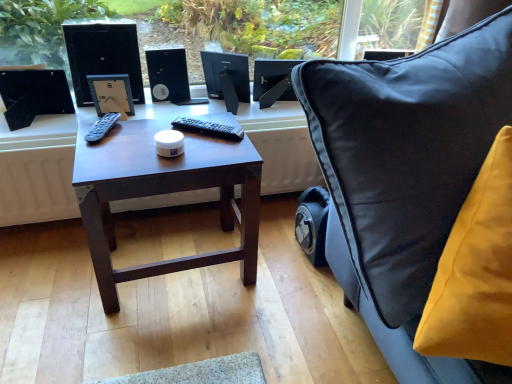
Question: Is black glossy desktop computer at upper left surrounding dark wood table at center?

Choices:
 (A) yes
 (B) no

Answer: (B)

Question: Is the position of black glossy desktop computer at upper left less distant than that of dark wood table at center?

Choices:
 (A) yes
 (B) no

Answer: (B)

Question: Can you confirm if black glossy desktop computer at upper left is taller than dark wood table at center?

Choices:
 (A) no
 (B) yes

Answer: (A)

Question: From a real-world perspective, is black glossy desktop computer at upper left on top of dark wood table at center?

Choices:
 (A) no
 (B) yes

Answer: (B)

Question: Does black glossy desktop computer at upper left turn towards dark wood table at center?

Choices:
 (A) no
 (B) yes

Answer: (B)

Question: Is black glossy desktop computer at upper left bigger than dark wood table at center?

Choices:
 (A) yes
 (B) no

Answer: (B)

Question: Is black glossy desktop computer at upper left bigger than velvet yellow cushion at right?

Choices:
 (A) no
 (B) yes

Answer: (A)

Question: Is black glossy desktop computer at upper left to the left of velvet yellow cushion at right from the viewer's perspective?

Choices:
 (A) no
 (B) yes

Answer: (B)

Question: From a real-world perspective, is black glossy desktop computer at upper left positioned under velvet yellow cushion at right based on gravity?

Choices:
 (A) no
 (B) yes

Answer: (B)

Question: From the image's perspective, would you say black glossy desktop computer at upper left is shown under velvet yellow cushion at right?

Choices:
 (A) no
 (B) yes

Answer: (A)

Question: Is black glossy desktop computer at upper left facing away from velvet yellow cushion at right?

Choices:
 (A) no
 (B) yes

Answer: (A)

Question: Does black glossy desktop computer at upper left have a lesser height compared to velvet yellow cushion at right?

Choices:
 (A) no
 (B) yes

Answer: (B)

Question: Is black plastic speaker at center next to black glossy desktop computer at upper left and touching it?

Choices:
 (A) no
 (B) yes

Answer: (A)